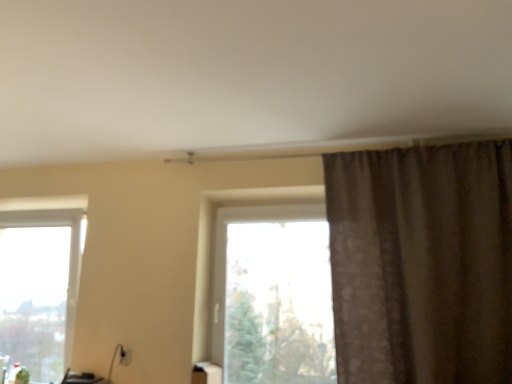
Question: From the image's perspective, is white glossy tissue box at lower center above or below clear glass window at lower left, the 1th window from the left?

Choices:
 (A) below
 (B) above

Answer: (A)

Question: Does point (202, 370) appear closer or farther from the camera than point (54, 375)?

Choices:
 (A) farther
 (B) closer

Answer: (B)

Question: Which of these objects is positioned closest to the clear glass window at lower left, the 2th window in the right-to-left sequence?

Choices:
 (A) transparent glass window at center, acting as the second window starting from the left
 (B) white glossy tissue box at lower center
 (C) brown textured curtain at upper right

Answer: (B)

Question: Based on their relative distances, which object is nearer to the white glossy tissue box at lower center?

Choices:
 (A) clear glass window at lower left, the 1th window from the left
 (B) brown textured curtain at upper right
 (C) transparent glass window at center, which appears as the first window when viewed from the right

Answer: (C)